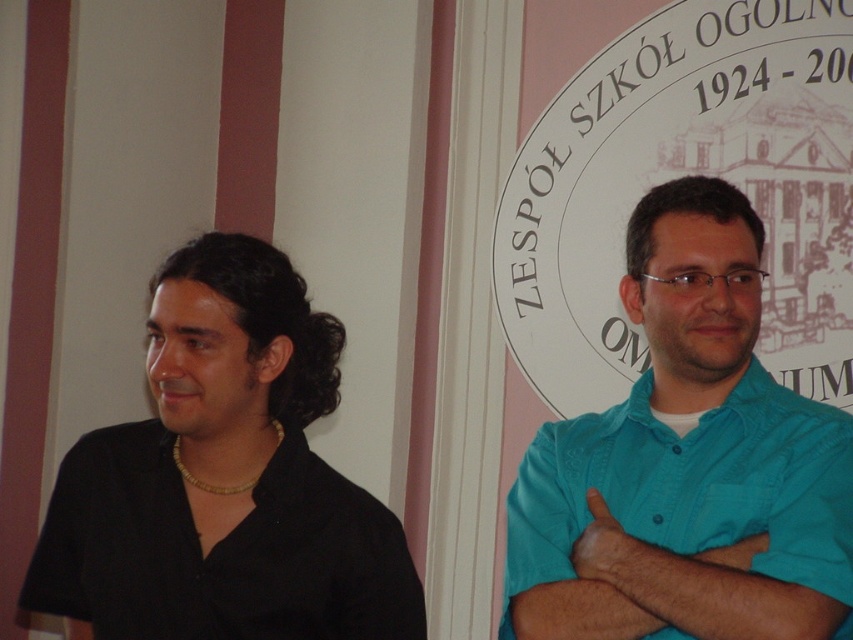
Question: From the image, what is the correct spatial relationship of teal cotton shirt at right in relation to black matte shirt at left?

Choices:
 (A) right
 (B) left

Answer: (A)

Question: Is teal cotton shirt at right positioned behind black matte shirt at left?

Choices:
 (A) yes
 (B) no

Answer: (B)

Question: Does teal cotton shirt at right have a larger size compared to black matte shirt at left?

Choices:
 (A) yes
 (B) no

Answer: (A)

Question: Among these points, which one is nearest to the camera?

Choices:
 (A) (227, 545)
 (B) (511, 628)

Answer: (B)